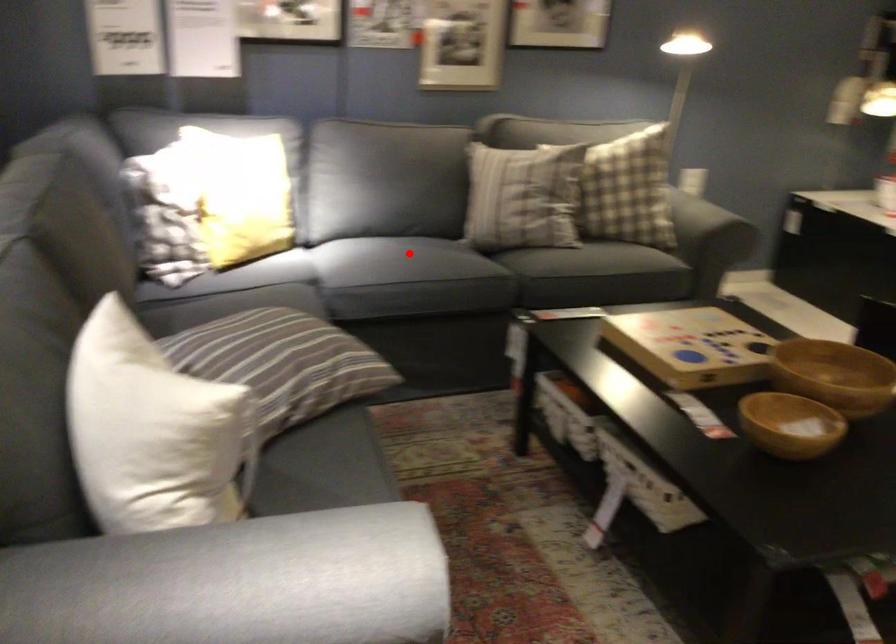
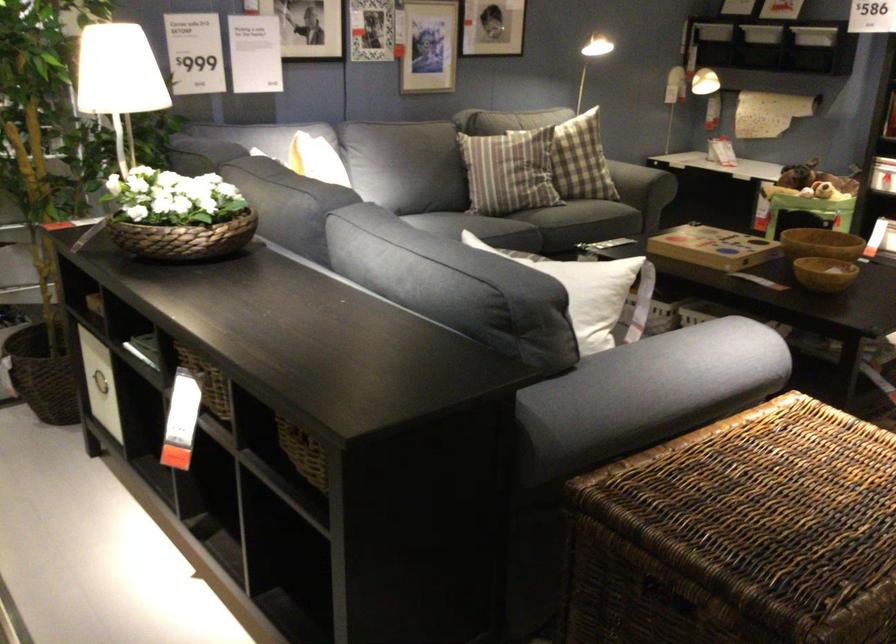
Question: I am providing you with two images of the same scene from different viewpoints. Image1 has a red point marked. In image2, the corresponding 3D location appears at what relative position? Reply with the corresponding letter.

Choices:
 (A) Closer
 (B) Farther

Answer: (B)